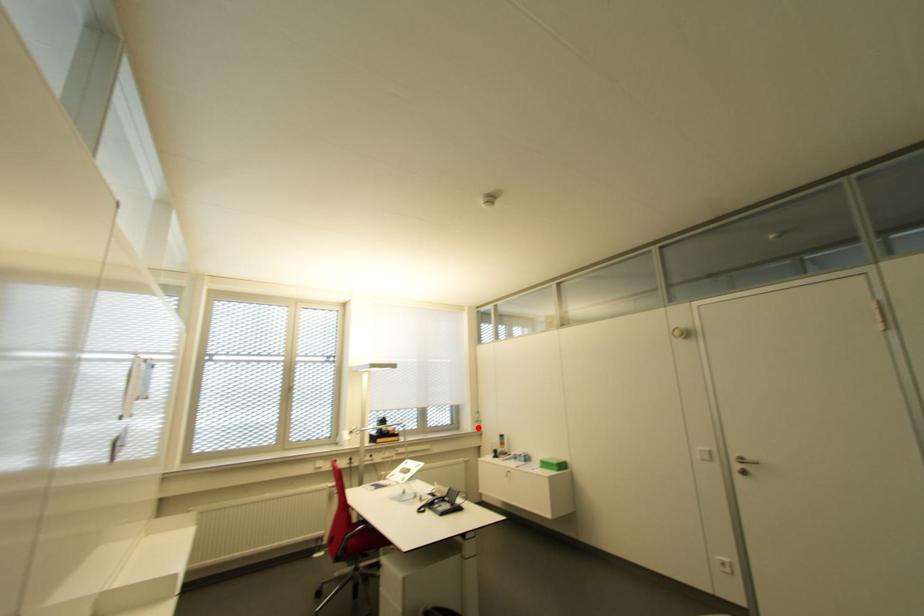
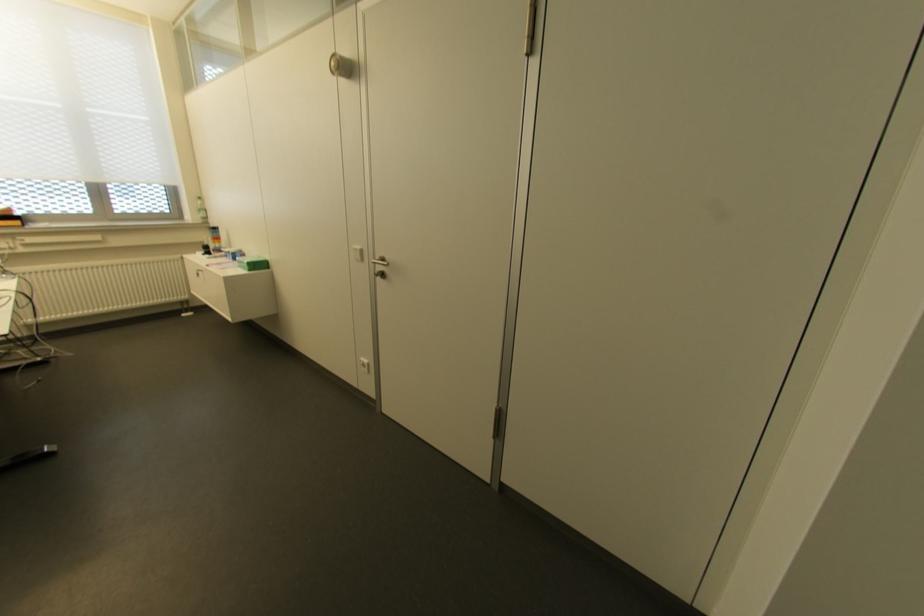
Question: I am providing you with two images of the same scene from different viewpoints. A red point is marked on the first image. Can you still see the location of the red point in image 2?

Choices:
 (A) Yes
 (B) No

Answer: (A)